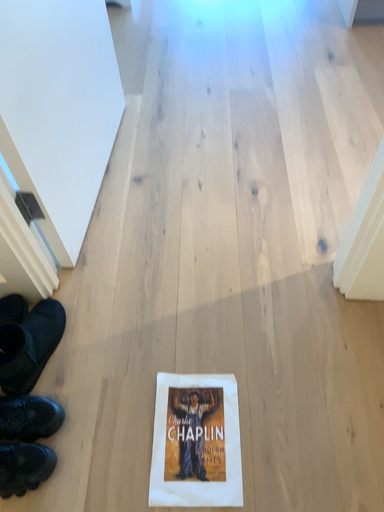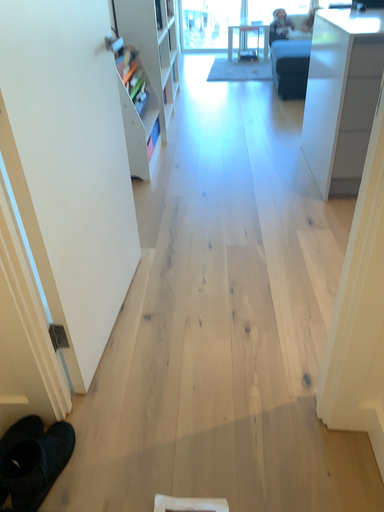
Question: How did the camera likely rotate when shooting the video?

Choices:
 (A) rotated downward
 (B) rotated upward

Answer: (B)